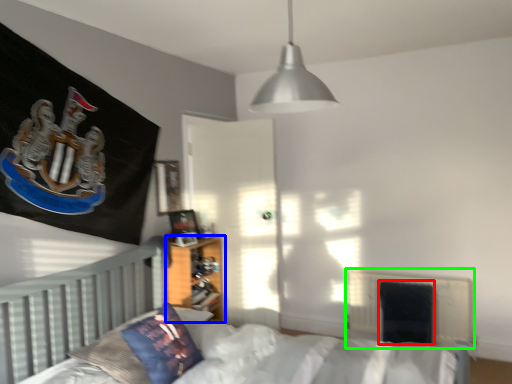
Question: Considering the real-world distances, which object is farthest from armchair (highlighted by a red box)? nightstand (highlighted by a blue box) or radiator (highlighted by a green box)?

Choices:
 (A) nightstand
 (B) radiator

Answer: (A)